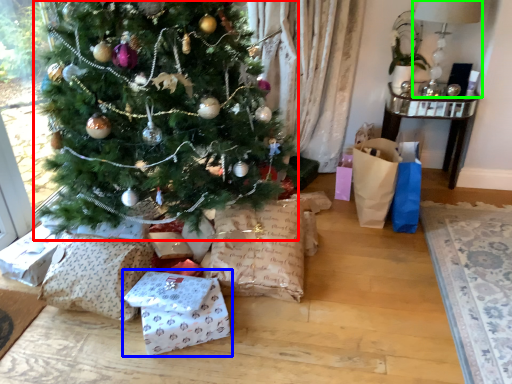
Question: Which object is the closest to the christmas tree (highlighted by a red box)? Choose among these: gift wrap (highlighted by a blue box) or lamp (highlighted by a green box).

Choices:
 (A) gift wrap
 (B) lamp

Answer: (A)